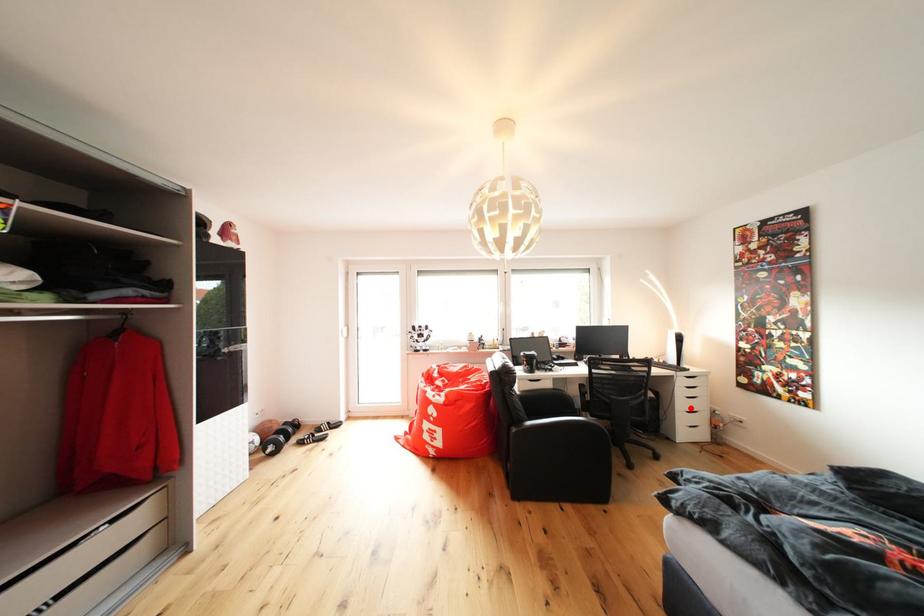
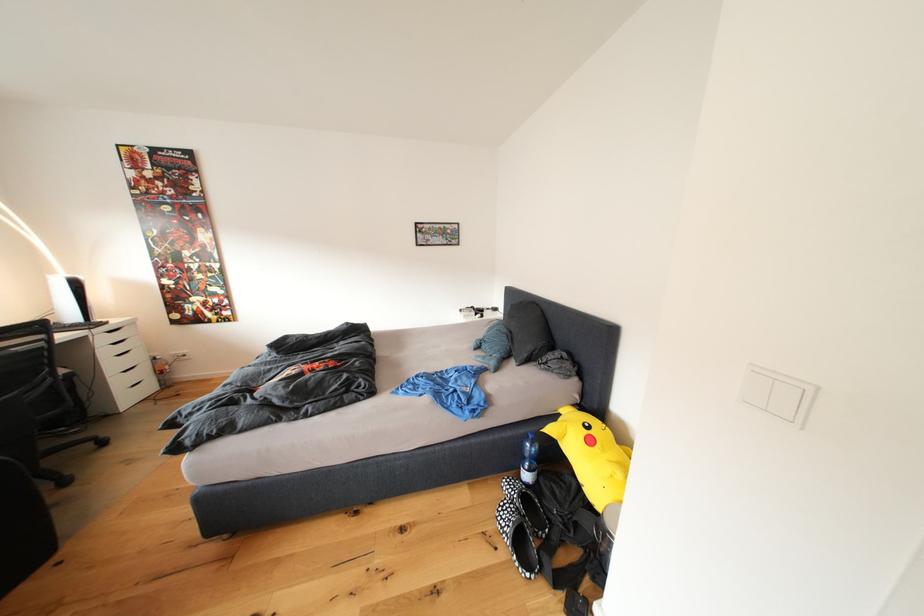
Locate, in the second image, the point that corresponds to the highlighted location in the first image.

(120, 370)